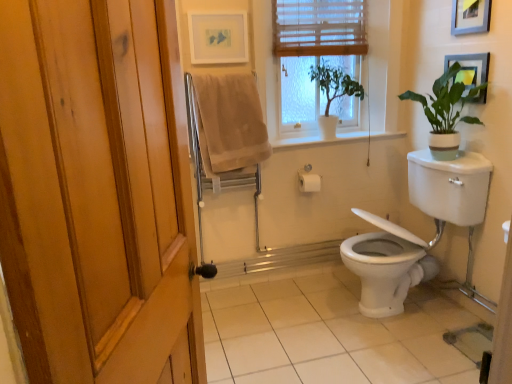
Image resolution: width=512 pixels, height=384 pixels. In order to click on vacant space underneath beige cotton towel at upper center (from a real-world perspective) in this screenshot , I will do `click(244, 299)`.